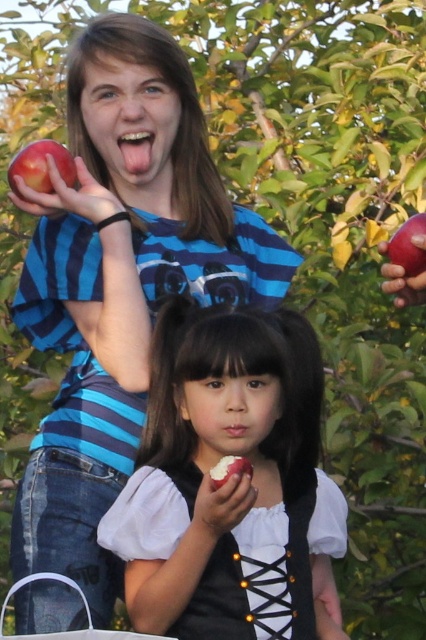
Can you confirm if smooth white apple at center is wider than pink matte lips at center?

Correct, the width of smooth white apple at center exceeds that of pink matte lips at center.

Is smooth white apple at center closer to the viewer compared to pink matte lips at center?

Yes, it is.

Between point (221, 596) and point (224, 432), which one is positioned in front?

Point (221, 596)

Locate an element on the screen. smooth white apple at center is located at coordinates (230, 483).

Who is shorter, smooth white apple at center or red matte apple at upper right?

red matte apple at upper right

Does smooth white apple at center have a lesser width compared to red matte apple at upper right?

No, smooth white apple at center is not thinner than red matte apple at upper right.

The width and height of the screenshot is (426, 640). Describe the element at coordinates (230, 483) in the screenshot. I see `smooth white apple at center` at that location.

Identify the location of smooth white apple at center. (230, 483).

Is point (48, 182) closer to camera compared to point (146, 150)?

Yes, point (48, 182) is closer to viewer.

Who is taller, shiny red apple at upper left or smooth pink tongue at upper center?

With more height is shiny red apple at upper left.

Is point (69, 172) behind point (137, 134)?

No, (69, 172) is closer to viewer.

Locate an element on the screen. shiny red apple at upper left is located at coordinates (40, 166).